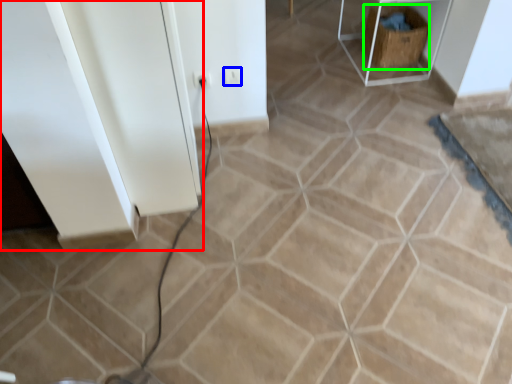
Question: Based on their relative distances, which object is farther from cabinetry (highlighted by a red box)? Choose from electric outlet (highlighted by a blue box) and crate (highlighted by a green box).

Choices:
 (A) electric outlet
 (B) crate

Answer: (B)